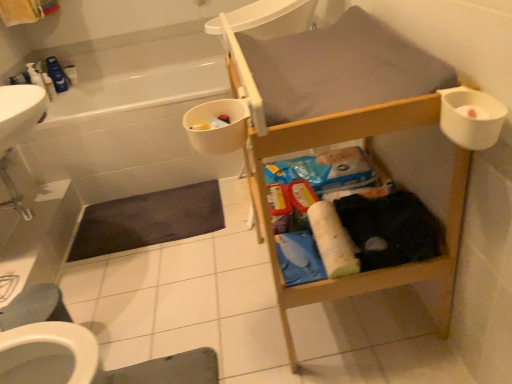
The width and height of the screenshot is (512, 384). Find the location of `vacant space situated above white plastic bidet at lower left (from a real-world perspective)`. vacant space situated above white plastic bidet at lower left (from a real-world perspective) is located at coordinates point(29,302).